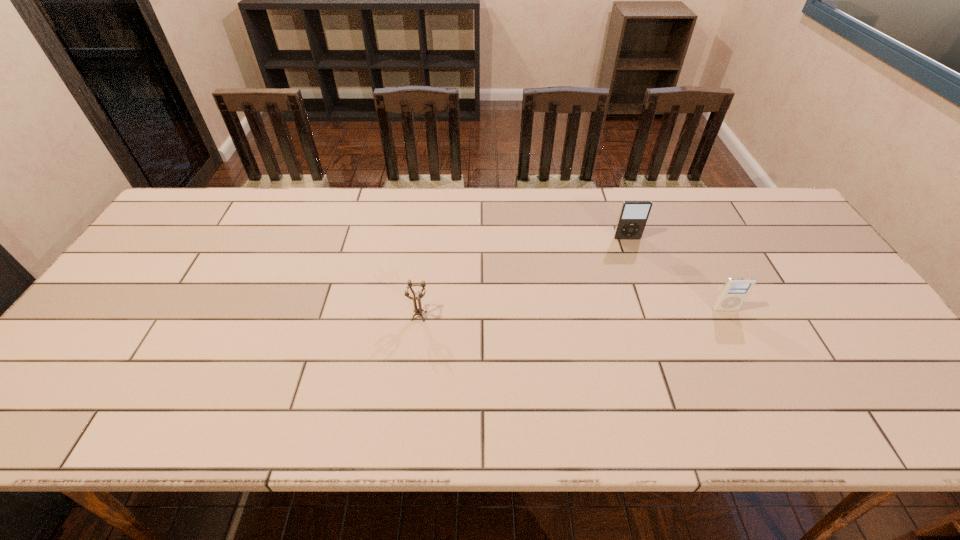
Identify the location of vacant point located between the farther iPod and the right iPod. (676, 274).

I want to click on unoccupied position between the second object from left to right and the leftmost object, so [523, 277].

This screenshot has height=540, width=960. What are the coordinates of `free spot between the leftmost object and the nearer iPod` in the screenshot? It's located at (572, 313).

The width and height of the screenshot is (960, 540). I want to click on object that is the closest one to the left iPod, so click(x=734, y=292).

Locate an element on the screen. The height and width of the screenshot is (540, 960). object that stands as the second closest to the leftmost object is located at coordinates [734, 292].